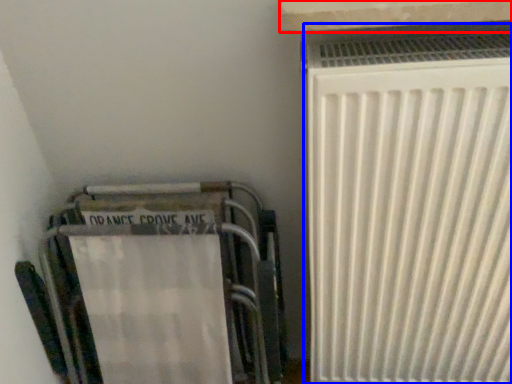
Question: Which point is further to the camera, window sill (highlighted by a red box) or radiator (highlighted by a blue box)?

Choices:
 (A) window sill
 (B) radiator

Answer: (B)